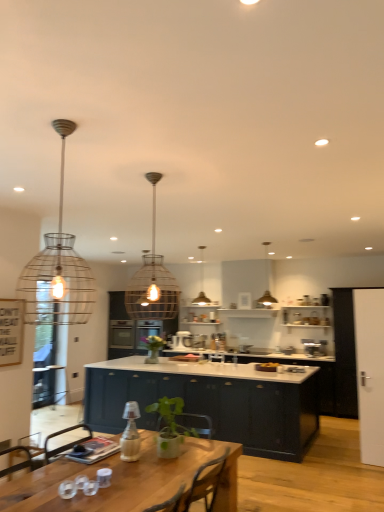
Question: Does satin silver toaster at center, the 2th appliance viewed from the back, come in front of glossy dark blue cabinet at center, which appears as the first cabinetry when viewed from the front?

Choices:
 (A) yes
 (B) no

Answer: (B)

Question: Considering the relative positions of satin silver toaster at center, the first appliance in the right-to-left sequence, and glossy dark blue cabinet at center, which appears as the second cabinetry when viewed from the back, in the image provided, is satin silver toaster at center, the first appliance in the right-to-left sequence, to the left of glossy dark blue cabinet at center, which appears as the second cabinetry when viewed from the back, from the viewer's perspective?

Choices:
 (A) no
 (B) yes

Answer: (A)

Question: From a real-world perspective, is satin silver toaster at center, the first appliance in the right-to-left sequence, beneath glossy dark blue cabinet at center, which appears as the first cabinetry when viewed from the front?

Choices:
 (A) yes
 (B) no

Answer: (B)

Question: Is satin silver toaster at center, which appears as the 1th appliance when viewed from the front, to the right of glossy dark blue cabinet at center, which appears as the second cabinetry when viewed from the back, from the viewer's perspective?

Choices:
 (A) yes
 (B) no

Answer: (A)

Question: Is satin silver toaster at center, which appears as the 1th appliance when viewed from the front, wider than glossy dark blue cabinet at center, which appears as the first cabinetry when viewed from the front?

Choices:
 (A) no
 (B) yes

Answer: (A)

Question: Does point (362, 385) appear closer or farther from the camera than point (203, 292)?

Choices:
 (A) farther
 (B) closer

Answer: (B)

Question: From a real-world perspective, is white glossy door at right physically located above or below metallic wire pendant light at center, acting as the fourth lamp starting from the front?

Choices:
 (A) below
 (B) above

Answer: (A)

Question: From the image's perspective, relative to metallic wire pendant light at center, arranged as the 2th lamp when viewed from the right, is white glossy door at right above or below?

Choices:
 (A) above
 (B) below

Answer: (B)

Question: Is white glossy door at right bigger or smaller than metallic wire pendant light at center, arranged as the 2th lamp when viewed from the right?

Choices:
 (A) small
 (B) big

Answer: (A)

Question: Is white glossy door at right to the left or to the right of glossy dark blue cabinet at center, which appears as the second cabinetry when viewed from the back, in the image?

Choices:
 (A) left
 (B) right

Answer: (B)

Question: Considering the positions of white glossy door at right and glossy dark blue cabinet at center, which appears as the first cabinetry when viewed from the front, in the image, is white glossy door at right bigger or smaller than glossy dark blue cabinet at center, which appears as the first cabinetry when viewed from the front,?

Choices:
 (A) big
 (B) small

Answer: (B)

Question: Does point (382, 458) appear closer or farther from the camera than point (266, 398)?

Choices:
 (A) closer
 (B) farther

Answer: (B)

Question: Is white glossy door at right in front of or behind glossy dark blue cabinet at center, which appears as the first cabinetry when viewed from the front, in the image?

Choices:
 (A) behind
 (B) front

Answer: (B)

Question: Is metallic wire pendant light at upper center, which is the 4th lamp from left to right, inside or outside of wooden table at lower left?

Choices:
 (A) outside
 (B) inside

Answer: (A)

Question: Considering the relative positions of metallic wire pendant light at upper center, which ranks as the third lamp in front-to-back order, and wooden table at lower left in the image provided, is metallic wire pendant light at upper center, which ranks as the third lamp in front-to-back order, to the left or to the right of wooden table at lower left?

Choices:
 (A) left
 (B) right

Answer: (B)